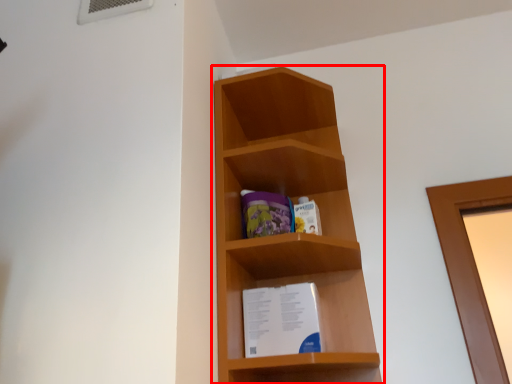
Question: From the image's perspective, where is shelf (annotated by the red box) located in relation to paperback book in the image?

Choices:
 (A) above
 (B) below

Answer: (A)